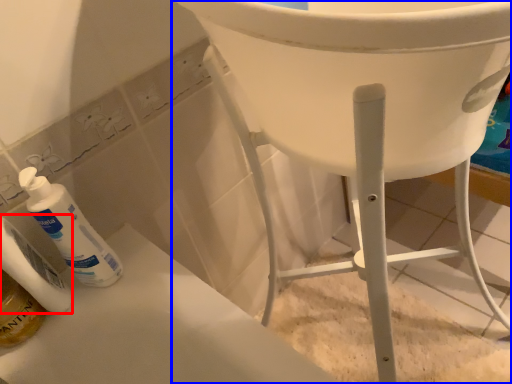
Question: Which object is closer to the camera taking this photo, toiletry (highlighted by a red box) or furniture (highlighted by a blue box)?

Choices:
 (A) toiletry
 (B) furniture

Answer: (A)